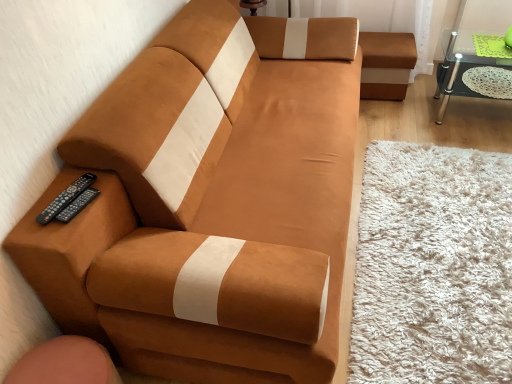
Question: Considering the positions of point (79, 183) and point (488, 96), is point (79, 183) closer or farther from the camera than point (488, 96)?

Choices:
 (A) closer
 (B) farther

Answer: (A)

Question: In terms of width, does black plastic remote at lower left, which is counted as the second remote, starting from the right, look wider or thinner when compared to transparent glass table at upper right?

Choices:
 (A) wide
 (B) thin

Answer: (B)

Question: Which object is positioned farthest from the black plastic remote at lower left, positioned as the second remote in left-to-right order?

Choices:
 (A) black plastic remote at lower left, which ranks as the first remote in left-to-right order
 (B) suede-like brown couch at left
 (C) transparent glass table at upper right

Answer: (C)

Question: Considering the real-world distances, which object is farthest from the suede-like brown couch at left?

Choices:
 (A) black plastic remote at lower left, positioned as the second remote in left-to-right order
 (B) black plastic remote at lower left, which ranks as the first remote in left-to-right order
 (C) transparent glass table at upper right

Answer: (C)